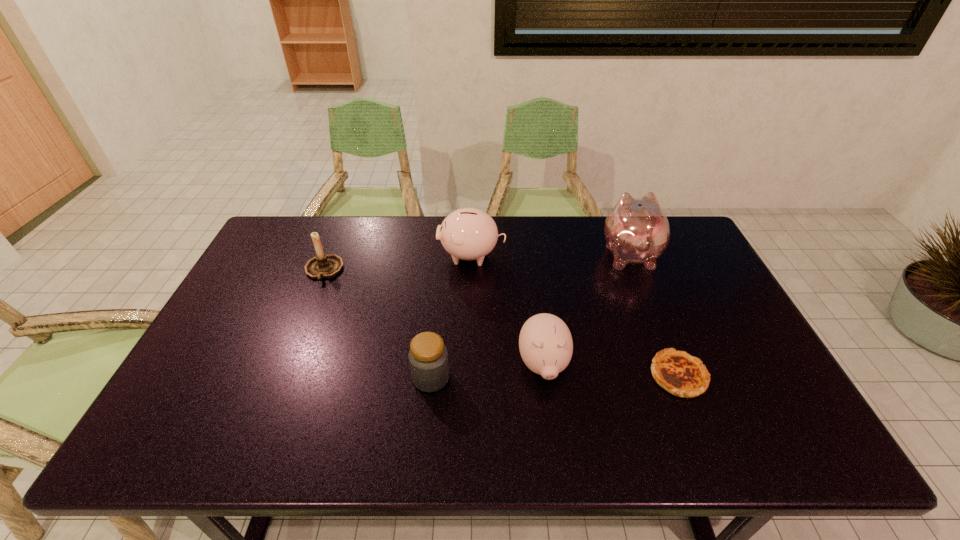
Where is `unoccupied area between the leftmost object and the second piggy bank from right to left`? The height and width of the screenshot is (540, 960). unoccupied area between the leftmost object and the second piggy bank from right to left is located at coordinates (434, 318).

The width and height of the screenshot is (960, 540). In order to click on free spot between the jar and the candle holder in this screenshot , I will do `click(377, 324)`.

This screenshot has width=960, height=540. Identify the location of vacant space that's between the tallest piggy bank and the leftmost piggy bank. (550, 255).

You are a GUI agent. You are given a task and a screenshot of the screen. Output one action in this format:
    pyautogui.click(x=<x>, y=<y>)
    Task: Click on the blank region between the tallest piggy bank and the leftmost object
    
    Given the screenshot: What is the action you would take?
    pyautogui.click(x=476, y=262)

Identify which object is the fourth closest to the leftmost piggy bank. Please provide its 2D coordinates. Your answer should be formatted as a tuple, i.e. [(x, y)], where the tuple contains the x and y coordinates of a point satisfying the conditions above.

[(428, 357)]

Identify which object is the third closest to the nearest piggy bank. Please provide its 2D coordinates. Your answer should be formatted as a tuple, i.e. [(x, y)], where the tuple contains the x and y coordinates of a point satisfying the conditions above.

[(468, 233)]

The height and width of the screenshot is (540, 960). I want to click on the third closest piggy bank to the jar, so click(x=636, y=230).

Find the location of a particular element. The height and width of the screenshot is (540, 960). the closest piggy bank relative to the shortest object is located at coordinates (545, 342).

Locate an element on the screen. This screenshot has width=960, height=540. vacant space that satisfies the following two spatial constraints: 1. on the back side of the leftmost piggy bank; 2. on the left side of the leftmost object is located at coordinates (330, 255).

This screenshot has width=960, height=540. In order to click on vacant space that satisfies the following two spatial constraints: 1. at the snout of the shortest object; 2. on the right side of the shortest piggy bank in this screenshot , I will do `click(544, 375)`.